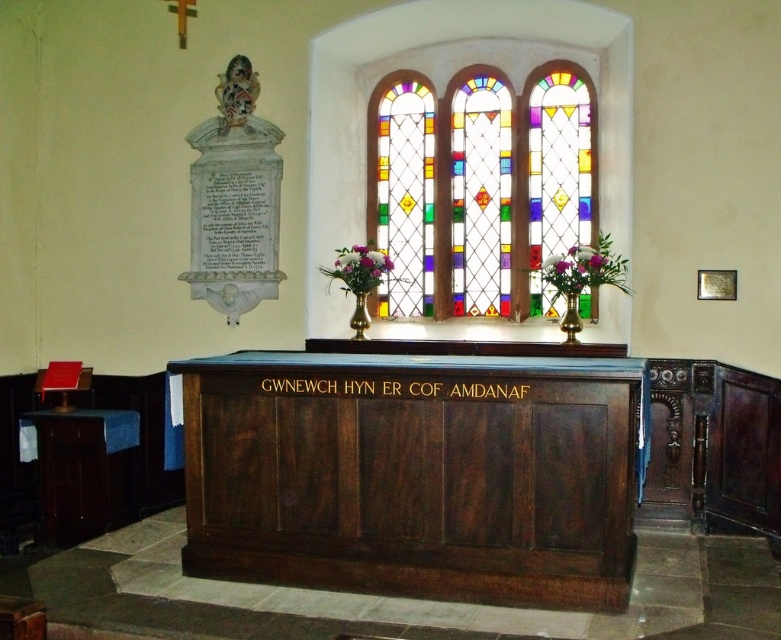
You are an interior designer planning to place a new decorative item between the dark wood altar at center and the black wood sign at center. Given that the decorative item requires 20 inches of space, will there be enough room between them to accommodate it?

The dark wood altar at center and black wood sign at center are 20.15 inches apart, which is just enough space to fit the decorative item requiring 20 inches of space.

Based on the photo, you are standing in the church and want to take a photo of the stained glass at upper center. The camera you are using has a 50mm lens. To ensure the entire stained glass is in the frame, where should you position yourself relative to the altar?

The stained glass at upper center is located at point (480, 188) in 2D coordinates, so you should position yourself directly in front of the altar to capture it in the center of your frame with a 50mm lens.

You are standing in the church and want to place a small candle on the black wood sign at center without blocking the view of the stained glass at upper center. Is this possible?

Answer: The stained glass at upper center is above the black wood sign at center, so placing a small candle on the black wood sign at center would not block the view of the stained glass at upper center.